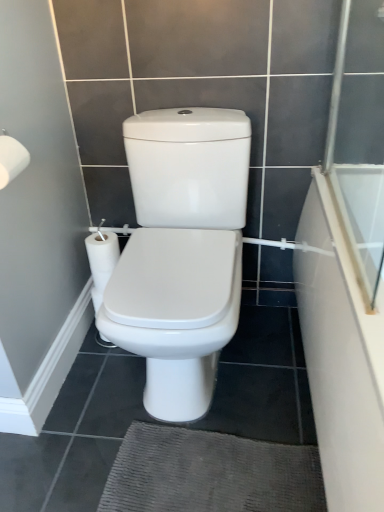
At what (x,y) coordinates should I click in order to perform the action: click on transparent glass screen door at right. Please return your answer as a coordinate pair (x, y). This screenshot has width=384, height=512. Looking at the image, I should click on (357, 157).

What do you see at coordinates (340, 359) in the screenshot?
I see `white glossy bathtub at right` at bounding box center [340, 359].

You are a GUI agent. You are given a task and a screenshot of the screen. Output one action in this format:
    pyautogui.click(x=<x>, y=<y>)
    Task: Click on the transparent glass screen door at right
    
    Given the screenshot: What is the action you would take?
    [357, 157]

Can you confirm if transparent glass screen door at right is bigger than white matte toilet paper at upper left?

Indeed, transparent glass screen door at right has a larger size compared to white matte toilet paper at upper left.

From a real-world perspective, between transparent glass screen door at right and white matte toilet paper at upper left, who is vertically higher?

transparent glass screen door at right is physically above.

From the image's perspective, which one is positioned higher, transparent glass screen door at right or white matte toilet paper at upper left?

transparent glass screen door at right is shown above in the image.

Considering the relative positions of transparent glass screen door at right and white matte toilet paper at upper left in the image provided, is transparent glass screen door at right to the left or to the right of white matte toilet paper at upper left?

Based on their positions, transparent glass screen door at right is located to the right of white matte toilet paper at upper left.

Can you confirm if white matte toilet paper at upper left is taller than transparent glass screen door at right?

Incorrect, the height of white matte toilet paper at upper left is not larger of that of transparent glass screen door at right.

Is white matte toilet paper at upper left looking in the opposite direction of transparent glass screen door at right?

That's not correct — white matte toilet paper at upper left is not looking away from transparent glass screen door at right.

Is white matte toilet paper at upper left not close to transparent glass screen door at right?

No, there isn't a large distance between white matte toilet paper at upper left and transparent glass screen door at right.

Considering the positions of objects transparent glass screen door at right and white glossy bathtub at right in the image provided, who is in front, transparent glass screen door at right or white glossy bathtub at right?

white glossy bathtub at right.

From the image's perspective, is transparent glass screen door at right above or below white glossy bathtub at right?

Based on their image positions, transparent glass screen door at right is located above white glossy bathtub at right.

Does transparent glass screen door at right turn towards white glossy bathtub at right?

No, transparent glass screen door at right is not facing towards white glossy bathtub at right.

From a real-world perspective, is white glossy bathtub at right physically above transparent glass screen door at right?

No, from a real-world perspective, white glossy bathtub at right is not above transparent glass screen door at right.

Based on the photo, between white glossy bathtub at right and transparent glass screen door at right, which one has smaller width?

With smaller width is transparent glass screen door at right.

Measure the distance from white glossy bathtub at right to transparent glass screen door at right.

The distance of white glossy bathtub at right from transparent glass screen door at right is 8.27 inches.

Is white glossy bathtub at right in front of or behind transparent glass screen door at right in the image?

Visually, white glossy bathtub at right is located in front of transparent glass screen door at right.

Is white matte toilet paper at upper left taller than white glossy bathtub at right?

No, white matte toilet paper at upper left is not taller than white glossy bathtub at right.

From the image's perspective, which is above, white matte toilet paper at upper left or white glossy bathtub at right?

white matte toilet paper at upper left is shown above in the image.

Based on the photo, can you confirm if white matte toilet paper at upper left is wider than white glossy bathtub at right?

No.

Is white matte toilet paper at upper left to the left or to the right of white glossy bathtub at right in the image?

white matte toilet paper at upper left is positioned on white glossy bathtub at right's left side.

Consider the image. Is white matte toilet paper at upper left at the back of white glossy bathtub at right?

white glossy bathtub at right does not have its back to white matte toilet paper at upper left.

From the image's perspective, which is above, white glossy bathtub at right or white matte toilet paper at upper left?

white matte toilet paper at upper left is shown above in the image.

From a real-world perspective, is white glossy bathtub at right located higher than white matte toilet paper at upper left?

No, from a real-world perspective, white glossy bathtub at right is not over white matte toilet paper at upper left

At what (x,y) coordinates should I click in order to perform the action: click on bath that is below the white matte toilet paper at upper left (from the image's perspective). Please return your answer as a coordinate pair (x, y). Looking at the image, I should click on (340, 359).

Find the location of a particular element. The width and height of the screenshot is (384, 512). toilet paper that appears below the transparent glass screen door at right (from the image's perspective) is located at coordinates (11, 159).

Identify the location of toilet paper behind the transparent glass screen door at right. (11, 159).

From the image, which object appears to be nearer to white matte toilet paper at upper left, transparent glass screen door at right or white glossy bathtub at right?

The object closer to white matte toilet paper at upper left is white glossy bathtub at right.

Based on their spatial positions, is transparent glass screen door at right or white matte toilet paper at upper left closer to white glossy bathtub at right?

transparent glass screen door at right.

Which object lies further to the anchor point transparent glass screen door at right, white matte toilet paper at upper left or white glossy bathtub at right?

white matte toilet paper at upper left is further to transparent glass screen door at right.

Which object lies nearer to the anchor point white matte toilet paper at upper left, white glossy bathtub at right or transparent glass screen door at right?

white glossy bathtub at right is positioned closer to the anchor white matte toilet paper at upper left.

When comparing their distances from white glossy bathtub at right, does white matte toilet paper at upper left or transparent glass screen door at right seem further?

white matte toilet paper at upper left is further to white glossy bathtub at right.

In the scene shown: Looking at the image, which one is located closer to transparent glass screen door at right, white glossy bathtub at right or white matte toilet paper at upper left?

white glossy bathtub at right is closer to transparent glass screen door at right.

The height and width of the screenshot is (512, 384). In order to click on screen door between white matte toilet paper at upper left and white glossy bathtub at right in this screenshot , I will do `click(357, 157)`.